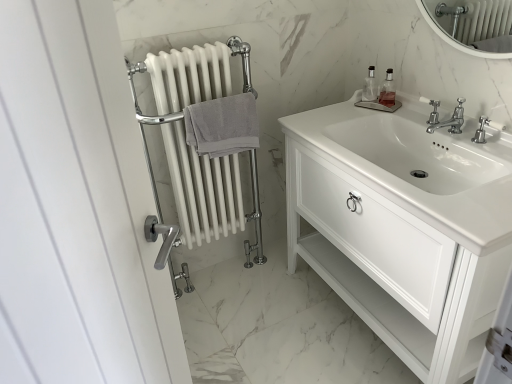
Question: Does clear glass soap dispenser at upper right, arranged as the 2th soap dispenser when viewed from the left, lie behind gray cotton towel at center-left?

Choices:
 (A) no
 (B) yes

Answer: (B)

Question: Is clear glass soap dispenser at upper right, which ranks as the first soap dispenser in right-to-left order, wider than gray cotton towel at center-left?

Choices:
 (A) no
 (B) yes

Answer: (A)

Question: Would you say clear glass soap dispenser at upper right, arranged as the 2th soap dispenser when viewed from the left, contains gray cotton towel at center-left?

Choices:
 (A) no
 (B) yes

Answer: (A)

Question: Is clear glass soap dispenser at upper right, arranged as the 2th soap dispenser when viewed from the left, taller than gray cotton towel at center-left?

Choices:
 (A) yes
 (B) no

Answer: (B)

Question: Can you confirm if clear glass soap dispenser at upper right, arranged as the 2th soap dispenser when viewed from the left, is thinner than gray cotton towel at center-left?

Choices:
 (A) no
 (B) yes

Answer: (B)

Question: From the image's perspective, is polished chrome faucet at center positioned above or below clear glass soap dispenser at upper right, placed as the 1th soap dispenser when sorted from left to right?

Choices:
 (A) below
 (B) above

Answer: (A)

Question: In terms of height, does polished chrome faucet at center look taller or shorter compared to clear glass soap dispenser at upper right, placed as the 1th soap dispenser when sorted from left to right?

Choices:
 (A) tall
 (B) short

Answer: (B)

Question: In the image, is polished chrome faucet at center positioned in front of or behind clear glass soap dispenser at upper right, placed as the 1th soap dispenser when sorted from left to right?

Choices:
 (A) behind
 (B) front

Answer: (B)

Question: Considering the positions of point (455, 125) and point (367, 79), is point (455, 125) closer or farther from the camera than point (367, 79)?

Choices:
 (A) farther
 (B) closer

Answer: (B)

Question: In terms of height, does gray cotton towel at center-left look taller or shorter compared to white glossy cabinet at center?

Choices:
 (A) short
 (B) tall

Answer: (A)

Question: In the image, is gray cotton towel at center-left positioned in front of or behind white glossy cabinet at center?

Choices:
 (A) front
 (B) behind

Answer: (B)

Question: Is point (217, 152) closer or farther from the camera than point (424, 107)?

Choices:
 (A) closer
 (B) farther

Answer: (A)

Question: From a real-world perspective, is gray cotton towel at center-left above or below white glossy cabinet at center?

Choices:
 (A) below
 (B) above

Answer: (B)

Question: Considering the positions of clear glass soap dispenser at upper right, placed as the 1th soap dispenser when sorted from left to right, and white glossy cabinet at center in the image, is clear glass soap dispenser at upper right, placed as the 1th soap dispenser when sorted from left to right, bigger or smaller than white glossy cabinet at center?

Choices:
 (A) small
 (B) big

Answer: (A)

Question: From a real-world perspective, is clear glass soap dispenser at upper right, placed as the 1th soap dispenser when sorted from left to right, above or below white glossy cabinet at center?

Choices:
 (A) above
 (B) below

Answer: (A)